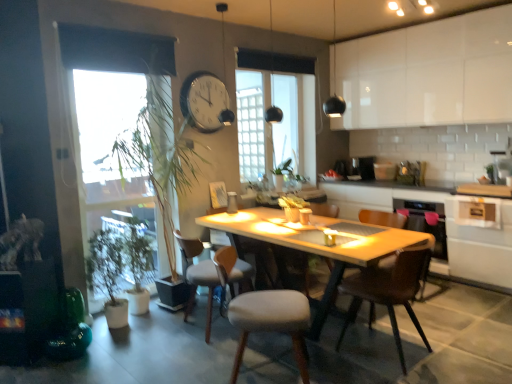
Question: Can you confirm if light gray fabric chair at center, the second chair in the back-to-front sequence, is wider than white glossy cabinet at lower right, which is counted as the first cabinetry, starting from the bottom?

Choices:
 (A) no
 (B) yes

Answer: (A)

Question: Is light gray fabric chair at center, the second chair in the back-to-front sequence, further to the viewer compared to white glossy cabinet at lower right, which is counted as the first cabinetry, starting from the bottom?

Choices:
 (A) no
 (B) yes

Answer: (B)

Question: Are light gray fabric chair at center, the fourth chair when ordered from front to back, and white glossy cabinet at lower right, which is counted as the first cabinetry, starting from the bottom, far apart?

Choices:
 (A) no
 (B) yes

Answer: (B)

Question: Is light gray fabric chair at center, the second chair in the back-to-front sequence, turned away from white glossy cabinet at lower right, which is counted as the first cabinetry, starting from the bottom?

Choices:
 (A) no
 (B) yes

Answer: (A)

Question: Is white glossy cabinet at lower right, which is counted as the first cabinetry, starting from the bottom, completely or partially inside light gray fabric chair at center, the fourth chair when ordered from front to back?

Choices:
 (A) no
 (B) yes

Answer: (A)

Question: Can you confirm if light gray fabric chair at center, the second chair in the back-to-front sequence, is bigger than white glossy cabinet at lower right, which ranks as the 2th cabinetry in top-to-bottom order?

Choices:
 (A) yes
 (B) no

Answer: (B)

Question: Does transparent glass window screen at left have a greater height compared to white glossy cabinet at lower right, which is counted as the first cabinetry, starting from the bottom?

Choices:
 (A) yes
 (B) no

Answer: (A)

Question: From a real-world perspective, is transparent glass window screen at left located beneath white glossy cabinet at lower right, which ranks as the 2th cabinetry in top-to-bottom order?

Choices:
 (A) no
 (B) yes

Answer: (A)

Question: Is transparent glass window screen at left at the right side of white glossy cabinet at lower right, which ranks as the 2th cabinetry in top-to-bottom order?

Choices:
 (A) yes
 (B) no

Answer: (B)

Question: Are transparent glass window screen at left and white glossy cabinet at lower right, which is counted as the first cabinetry, starting from the bottom, beside each other?

Choices:
 (A) yes
 (B) no

Answer: (B)

Question: Considering the relative positions of transparent glass window screen at left and white glossy cabinet at lower right, which is counted as the first cabinetry, starting from the bottom, in the image provided, is transparent glass window screen at left in front of white glossy cabinet at lower right, which is counted as the first cabinetry, starting from the bottom,?

Choices:
 (A) yes
 (B) no

Answer: (A)

Question: From the image's perspective, is transparent glass window screen at left on top of white glossy cabinet at lower right, which ranks as the 2th cabinetry in top-to-bottom order?

Choices:
 (A) yes
 (B) no

Answer: (A)

Question: Is white plastic clock at upper center shorter than light gray fabric chair at center, the fourth chair when ordered from front to back?

Choices:
 (A) no
 (B) yes

Answer: (B)